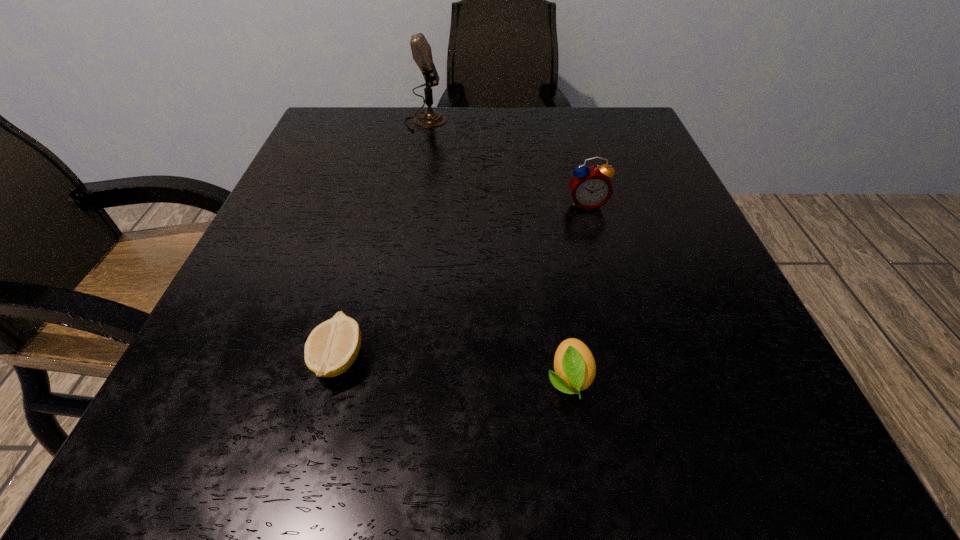
I want to click on empty space between the tallest object and the shortest object, so click(382, 240).

Find the location of a particular element. free area in between the alarm clock and the farthest object is located at coordinates (506, 163).

This screenshot has width=960, height=540. Find the location of `empty space that is in between the right lemon and the second farthest object`. empty space that is in between the right lemon and the second farthest object is located at coordinates (578, 291).

At what (x,y) coordinates should I click in order to perform the action: click on object identified as the closest to the shorter lemon. Please return your answer as a coordinate pair (x, y). The image size is (960, 540). Looking at the image, I should click on (574, 365).

Where is `object that is the third closest one to the farthest object`? object that is the third closest one to the farthest object is located at coordinates (574, 365).